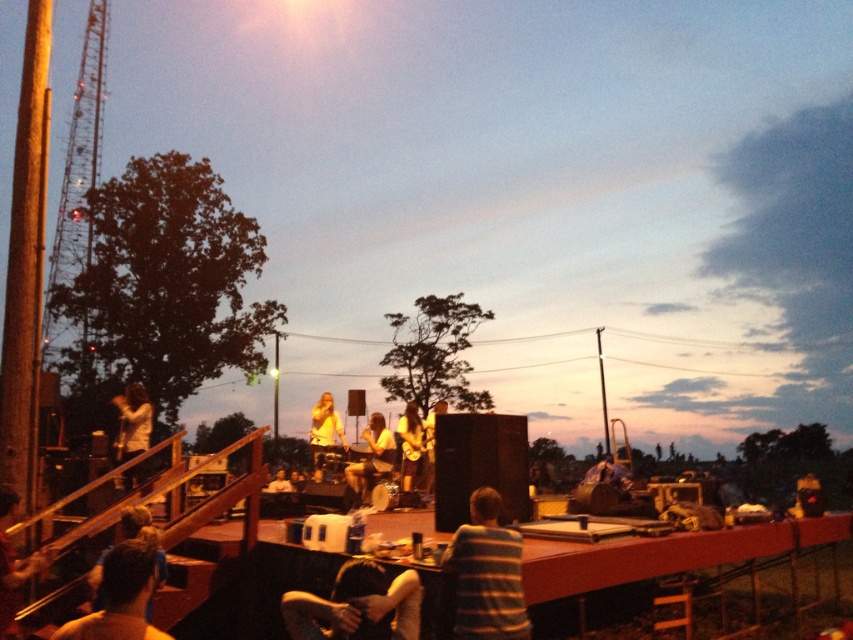
You are a photographer trying to capture the band members and their instruments. Given that the blue fabric shirt at lower left is smaller than the shiny silver drum set at center, which object should you focus on if you want to ensure both are visible in the frame without cropping?

Since the blue fabric shirt at lower left occupies less space than the shiny silver drum set at center, you should focus on the shiny silver drum set at center to ensure both objects fit within the frame without cropping.

You are a photographer at the event and want to capture both the striped fabric shirt at lower center and the matte black guitar at center in a single frame. Which object should you focus on first to ensure both are in the frame?

The striped fabric shirt at lower center is shorter than the matte black guitar at center, so you should focus on the matte black guitar at center first to ensure both are in the frame.

You are a photographer at the music event. You want to capture a photo where both the striped fabric shirt at lower center and the matte black guitar at center are visible. Based on their positions, which object should you focus on first to ensure both are in frame?

The striped fabric shirt at lower center is above the matte black guitar at center, so focusing on the striped fabric shirt at lower center first will ensure the matte black guitar at center is still in the frame below it.